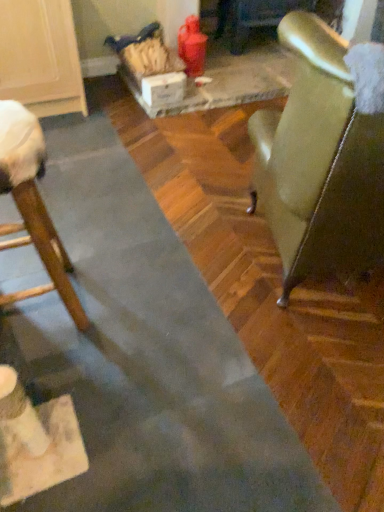
Question: Does white cardboard box at center have a lesser height compared to wooden chair at left, arranged as the second chair when viewed from the right?

Choices:
 (A) no
 (B) yes

Answer: (B)

Question: Is white cardboard box at center positioned far away from wooden chair at left, arranged as the second chair when viewed from the right?

Choices:
 (A) yes
 (B) no

Answer: (A)

Question: From a real-world perspective, is white cardboard box at center located higher than wooden chair at left, which ranks as the first chair in left-to-right order?

Choices:
 (A) no
 (B) yes

Answer: (A)

Question: Would you say white cardboard box at center contains wooden chair at left, which ranks as the first chair in left-to-right order?

Choices:
 (A) no
 (B) yes

Answer: (A)

Question: From the image's perspective, would you say white cardboard box at center is positioned over wooden chair at left, arranged as the second chair when viewed from the right?

Choices:
 (A) yes
 (B) no

Answer: (A)

Question: Is white cardboard box at center at the right side of wooden chair at left, arranged as the second chair when viewed from the right?

Choices:
 (A) yes
 (B) no

Answer: (A)

Question: Is there a large distance between wooden chair at left, arranged as the second chair when viewed from the right, and leather-like green chair at right, the first chair when ordered from right to left?

Choices:
 (A) yes
 (B) no

Answer: (B)

Question: Can you confirm if wooden chair at left, arranged as the second chair when viewed from the right, is shorter than leather-like green chair at right, arranged as the 2th chair when viewed from the left?

Choices:
 (A) no
 (B) yes

Answer: (B)

Question: Is wooden chair at left, which ranks as the first chair in left-to-right order, closer to camera compared to leather-like green chair at right, the first chair when ordered from right to left?

Choices:
 (A) yes
 (B) no

Answer: (B)

Question: Is the surface of wooden chair at left, which ranks as the first chair in left-to-right order, in direct contact with leather-like green chair at right, arranged as the 2th chair when viewed from the left?

Choices:
 (A) no
 (B) yes

Answer: (A)

Question: Is wooden chair at left, which ranks as the first chair in left-to-right order, completely or partially outside of leather-like green chair at right, the first chair when ordered from right to left?

Choices:
 (A) yes
 (B) no

Answer: (A)

Question: Is wooden chair at left, which ranks as the first chair in left-to-right order, positioned behind leather-like green chair at right, arranged as the 2th chair when viewed from the left?

Choices:
 (A) no
 (B) yes

Answer: (B)

Question: Is wooden chair at left, which ranks as the first chair in left-to-right order, thinner than white cardboard box at center?

Choices:
 (A) yes
 (B) no

Answer: (B)